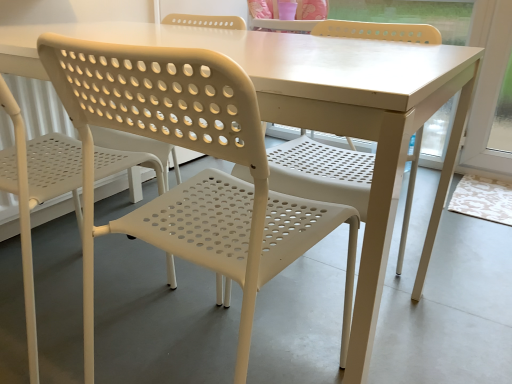
Find the location of `vacant location below white plastic chair at left, the 1th chair in the left-to-right sequence (from a real-world perspective)`. vacant location below white plastic chair at left, the 1th chair in the left-to-right sequence (from a real-world perspective) is located at coordinates (73, 306).